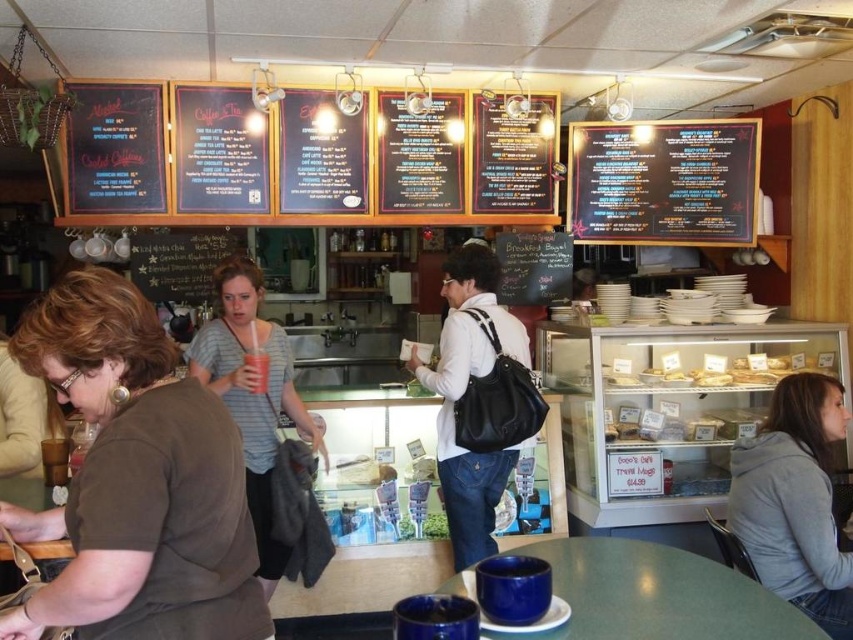
You are a customer in the bakery and want to know which staff member is closer to the entrance. The entrance is located near the lower left corner of the scene. The brown matte shirt at lower left and striped cotton shirt at center are both visible. Which staff member is closer to the entrance?

The brown matte shirt at lower left is closer to the entrance because it is located near the lower left corner of the scene, which is where the entrance is situated.

You are a customer in the cafe and want to order from the menu. You see the brown matte shirt at lower left and the black chalkboard menu at upper right. Which object is higher in the image?

The brown matte shirt at lower left is much taller than the black chalkboard menu at upper right, so the brown matte shirt at lower left is higher in the image.